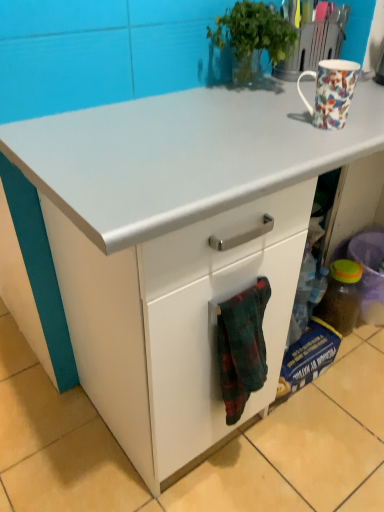
Find the location of a particular element. This screenshot has height=512, width=384. space that is in front of green leafy plant at upper center is located at coordinates (246, 120).